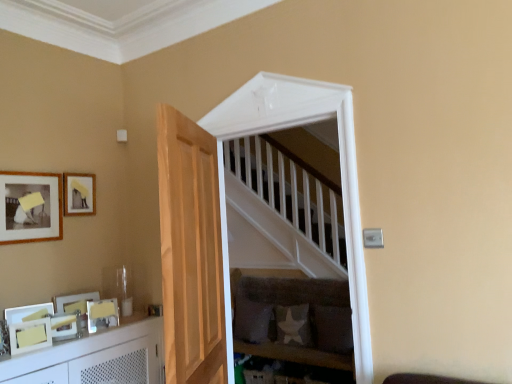
Question: Is the depth of white glossy picture frame at lower left, placed as the 1th picture frame when sorted from bottom to top, less than that of white fabric pillow at lower center, arranged as the 2th pillow when viewed from the left?

Choices:
 (A) yes
 (B) no

Answer: (A)

Question: Is white glossy picture frame at lower left, placed as the 1th picture frame when sorted from bottom to top, at the left side of white fabric pillow at lower center, arranged as the 2th pillow when viewed from the left?

Choices:
 (A) no
 (B) yes

Answer: (B)

Question: Does white glossy picture frame at lower left, placed as the 1th picture frame when sorted from bottom to top, have a lesser width compared to white fabric pillow at lower center, the 2th pillow positioned from the right?

Choices:
 (A) yes
 (B) no

Answer: (A)

Question: Does white glossy picture frame at lower left, placed as the 1th picture frame when sorted from bottom to top, have a lesser height compared to white fabric pillow at lower center, arranged as the 2th pillow when viewed from the left?

Choices:
 (A) no
 (B) yes

Answer: (B)

Question: Can you confirm if white glossy picture frame at lower left, acting as the 5th picture frame starting from the top, is taller than white fabric pillow at lower center, arranged as the 2th pillow when viewed from the left?

Choices:
 (A) no
 (B) yes

Answer: (A)

Question: Is white glossy picture frame at lower left, acting as the 5th picture frame starting from the top, turned away from white fabric pillow at lower center, the 2th pillow positioned from the right?

Choices:
 (A) no
 (B) yes

Answer: (A)

Question: Does velvet grey sofa at center lie in front of light brown wooden door at center?

Choices:
 (A) no
 (B) yes

Answer: (A)

Question: Can you confirm if velvet grey sofa at center is smaller than light brown wooden door at center?

Choices:
 (A) yes
 (B) no

Answer: (B)

Question: Is the position of velvet grey sofa at center more distant than that of light brown wooden door at center?

Choices:
 (A) no
 (B) yes

Answer: (B)

Question: Considering the relative sizes of velvet grey sofa at center and light brown wooden door at center in the image provided, is velvet grey sofa at center wider than light brown wooden door at center?

Choices:
 (A) yes
 (B) no

Answer: (A)

Question: Does velvet grey sofa at center contain light brown wooden door at center?

Choices:
 (A) no
 (B) yes

Answer: (A)

Question: Is velvet grey sofa at center placed right next to light brown wooden door at center?

Choices:
 (A) yes
 (B) no

Answer: (B)

Question: From a real-world perspective, does matte yellow picture frame at upper left, positioned as the 5th picture frame in bottom-to-top order, stand above light brown wooden door at center?

Choices:
 (A) no
 (B) yes

Answer: (B)